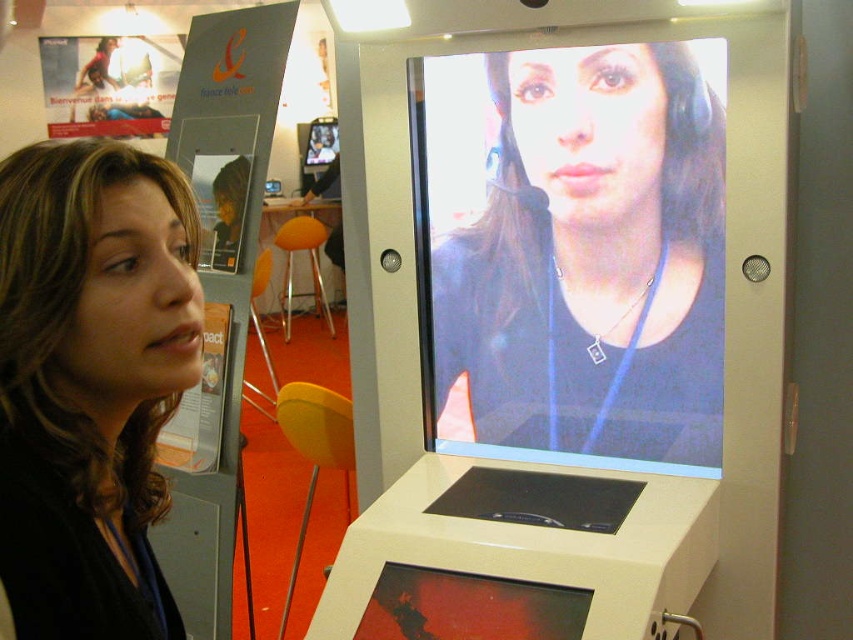
Who is higher up, matte black screen at center or matte black hair at left?

matte black screen at center is higher up.

Which is in front, point (664, 438) or point (143, 307)?

Point (143, 307) is more forward.

Image resolution: width=853 pixels, height=640 pixels. What are the coordinates of `matte black screen at center` in the screenshot? It's located at (592, 259).